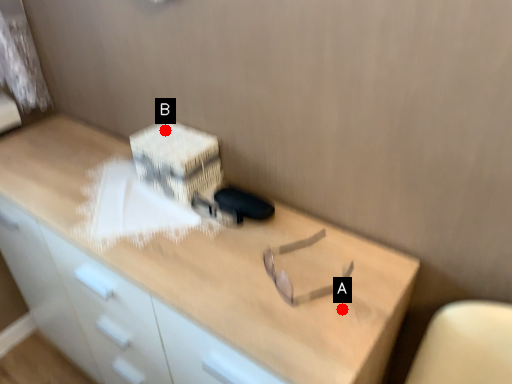
Question: Two points are circled on the image, labeled by A and B beside each circle. Which point is closer to the camera?

Choices:
 (A) A is closer
 (B) B is closer

Answer: (A)